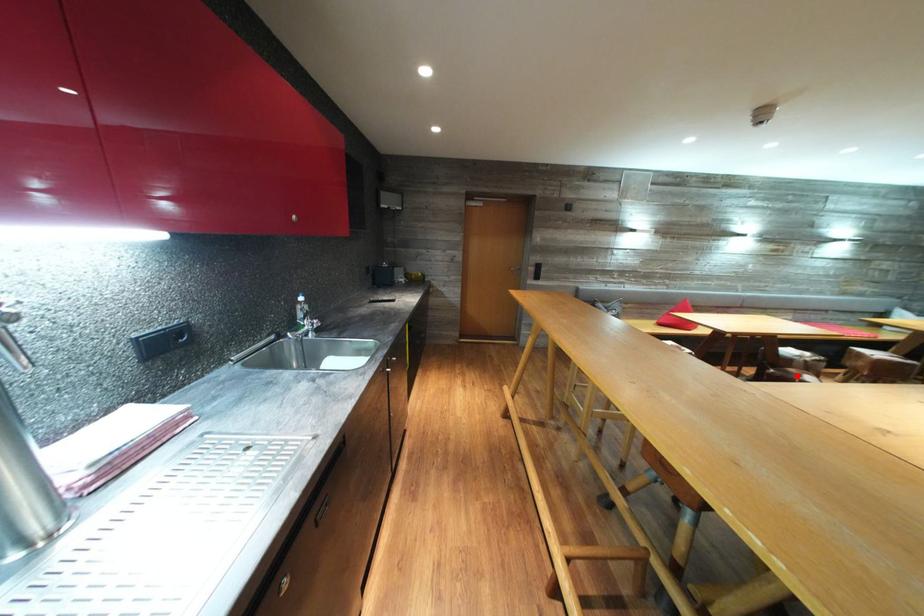
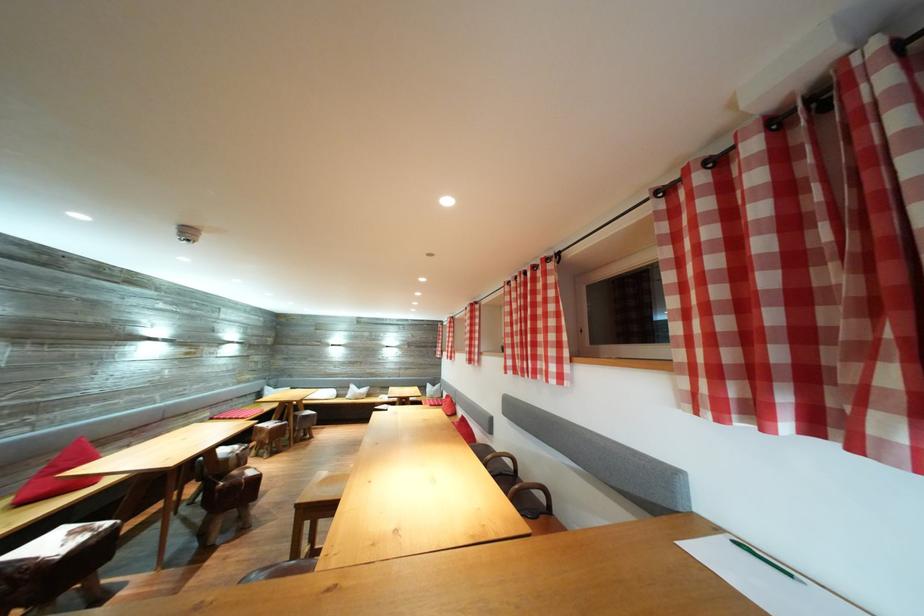
In the second image, find the point that corresponds to the highlighted location in the first image.

(241, 477)